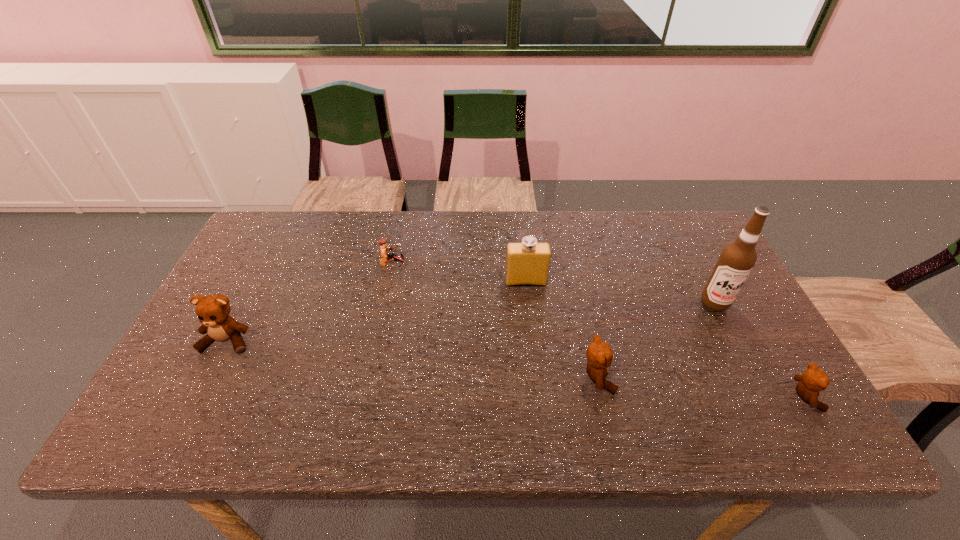
I want to click on free space between the perfume and the fourth tallest object, so click(562, 329).

Where is `unoccupied area between the second teddy bear from right to left and the second farthest object`? This screenshot has height=540, width=960. unoccupied area between the second teddy bear from right to left and the second farthest object is located at coordinates (562, 329).

Locate an element on the screen. This screenshot has width=960, height=540. vacant area between the alcohol and the fifth shortest object is located at coordinates (620, 292).

This screenshot has width=960, height=540. I want to click on free spot between the second teddy bear from right to left and the fifth nearest object, so click(562, 329).

I want to click on free area in between the third object from left to right and the alcohol, so click(x=620, y=292).

Where is `vacant point located between the farthest teddy bear and the fourth object from left to right`? The height and width of the screenshot is (540, 960). vacant point located between the farthest teddy bear and the fourth object from left to right is located at coordinates (413, 359).

You are a GUI agent. You are given a task and a screenshot of the screen. Output one action in this format:
    pyautogui.click(x=<x>, y=<y>)
    Task: Click on the free spot between the rightmost object and the second teddy bear from right to left
    The height and width of the screenshot is (540, 960).
    Given the screenshot: What is the action you would take?
    pyautogui.click(x=701, y=387)

You are a GUI agent. You are given a task and a screenshot of the screen. Output one action in this format:
    pyautogui.click(x=<x>, y=<y>)
    Task: Click on the vacant region between the leftmost object and the farthest object
    The height and width of the screenshot is (540, 960).
    Given the screenshot: What is the action you would take?
    [310, 303]

In order to click on vacant area between the perfume and the alcohol in this screenshot , I will do `click(620, 292)`.

Point out which object is positioned as the second nearest to the rightmost teddy bear. Please provide its 2D coordinates. Your answer should be formatted as a tuple, i.e. [(x, y)], where the tuple contains the x and y coordinates of a point satisfying the conditions above.

[(599, 355)]